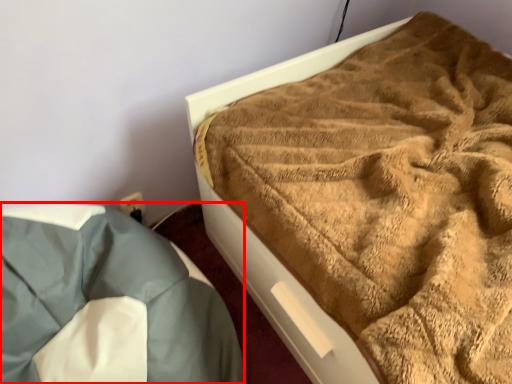
Question: From the image's perspective, where is bedding (annotated by the red box) located in relation to bed in the image?

Choices:
 (A) below
 (B) above

Answer: (A)